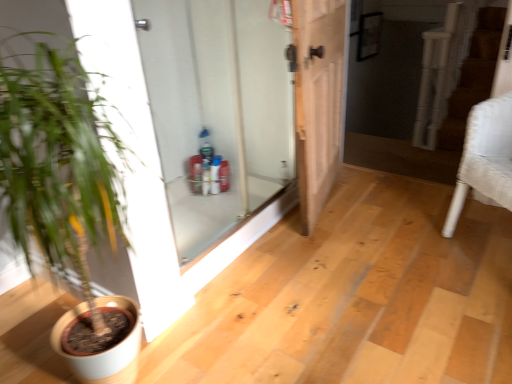
In order to click on vacant space to the right of white matte pot at left in this screenshot , I will do `click(274, 321)`.